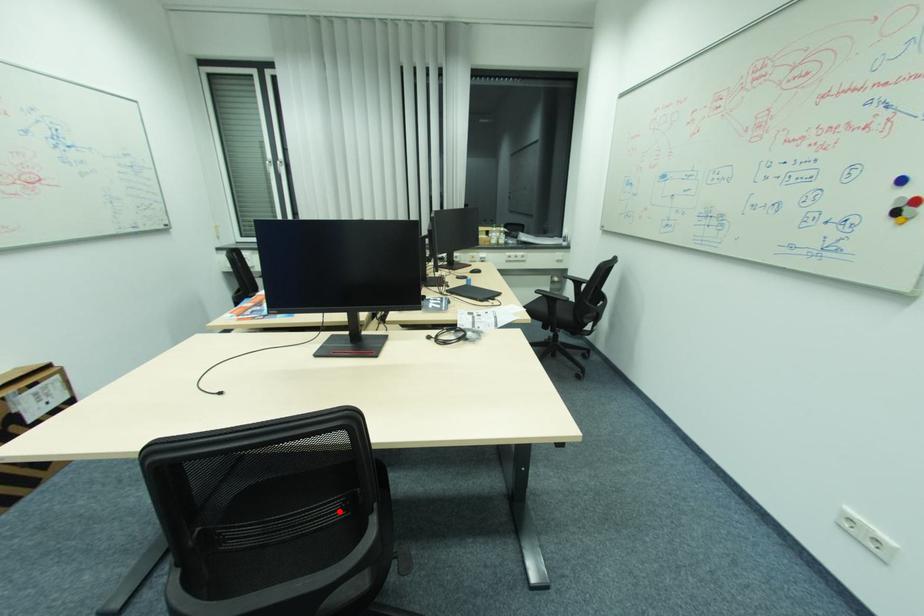
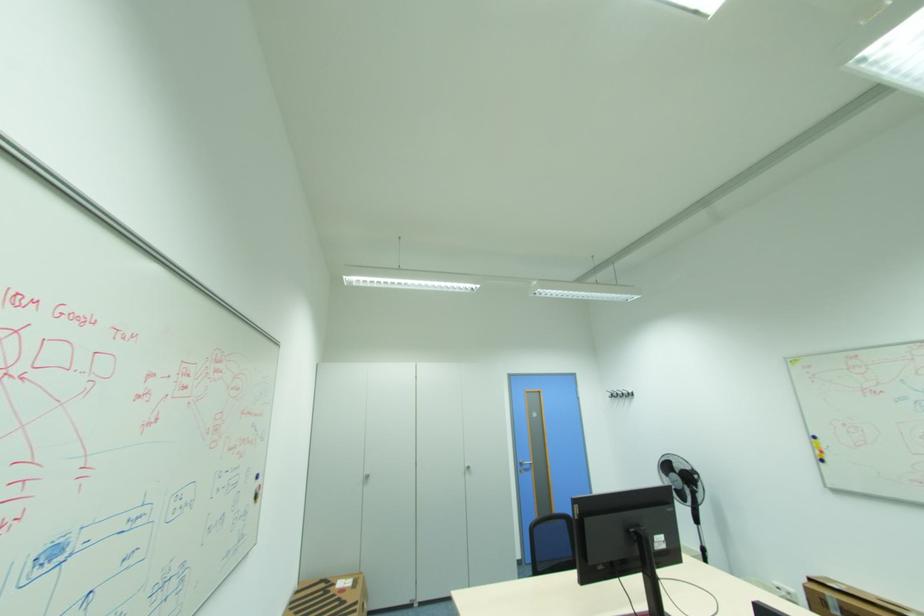
Question: I am providing you with two images of the same scene from different viewpoints. A red point is marked on the first image. Can you still see the location of the red point in image 2?

Choices:
 (A) Yes
 (B) No

Answer: (B)